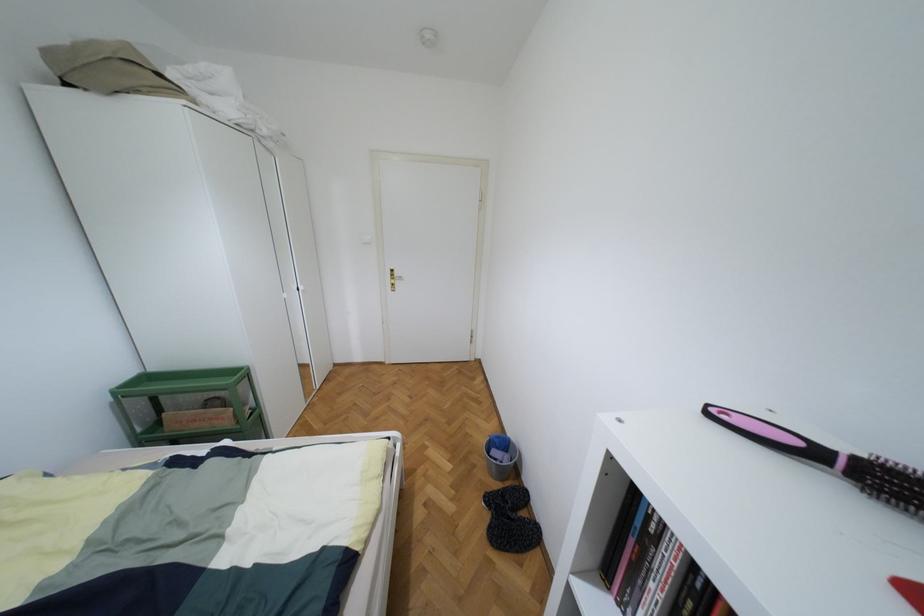
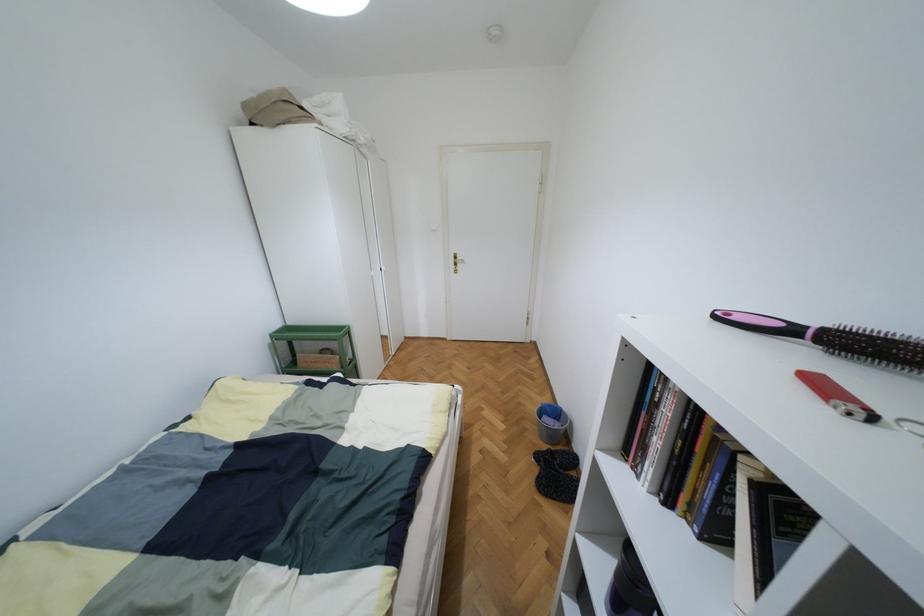
Question: The images are taken continuously from a first-person perspective. In which direction is your viewpoint rotating?

Choices:
 (A) Left
 (B) Right
 (C) Up
 (D) Down

Answer: (A)